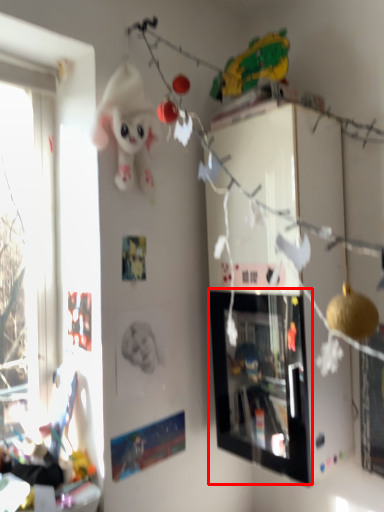
Question: Where is picture frame (annotated by the red box) located in relation to toy in the image?

Choices:
 (A) left
 (B) right

Answer: (B)